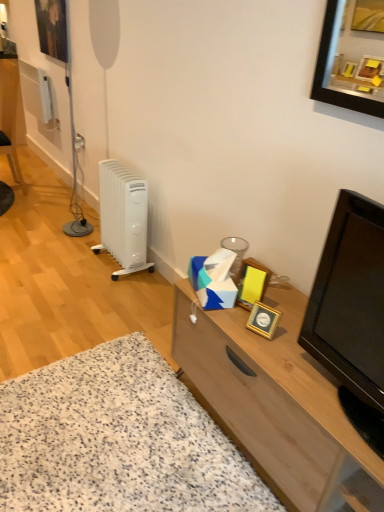
What are the coordinates of `vacant space to the left of gold metallic picture frame at center-right, which ranks as the 1th picture frame in bottom-to-top order` in the screenshot? It's located at (233, 325).